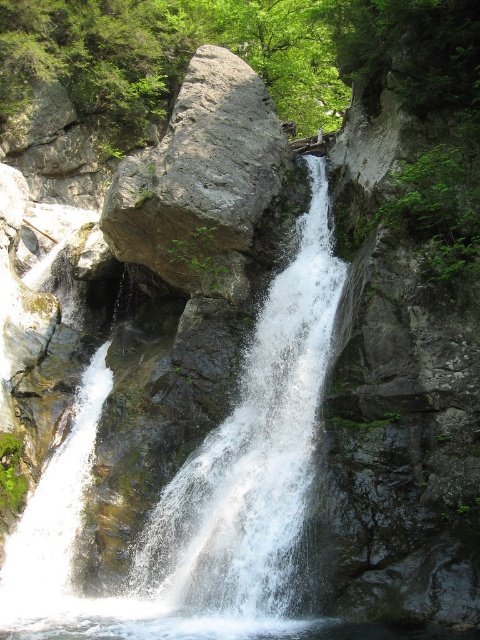
Looking at this image, who is taller, white frothy water at center or gray rock at center?

gray rock at center is taller.

The width and height of the screenshot is (480, 640). I want to click on white frothy water at center, so click(x=252, y=452).

This screenshot has height=640, width=480. Find the location of `white frothy water at center`. white frothy water at center is located at coordinates [252, 452].